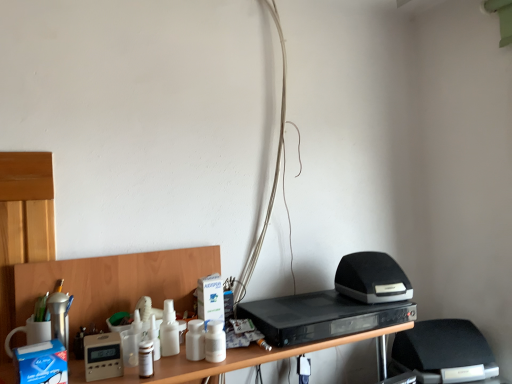
You are a GUI agent. You are given a task and a screenshot of the screen. Output one action in this format:
    pyautogui.click(x=<x>, y=<y>)
    Task: Click on the black matte speaker at right, the first appliance viewed from the top
    The image size is (512, 384).
    Given the screenshot: What is the action you would take?
    pyautogui.click(x=372, y=278)

What do you see at coordinates (372, 278) in the screenshot? The height and width of the screenshot is (384, 512). I see `black matte speaker at right, which appears as the second appliance when viewed from the left` at bounding box center [372, 278].

The height and width of the screenshot is (384, 512). What do you see at coordinates (274, 174) in the screenshot? I see `white matte wires at center` at bounding box center [274, 174].

You are a GUI agent. You are given a task and a screenshot of the screen. Output one action in this format:
    pyautogui.click(x=<x>, y=<y>)
    Task: Click on the black matte speaker at right, which appears as the 1th appliance when viewed from the back
    Image resolution: width=512 pixels, height=384 pixels.
    Given the screenshot: What is the action you would take?
    372,278

Is black matte speaker at right, which is the second appliance from bottom to top, looking in the opposite direction of white matte wires at center?

No, black matte speaker at right, which is the second appliance from bottom to top, is not facing away from white matte wires at center.

From a real-world perspective, relative to white matte wires at center, is black matte speaker at right, the first appliance viewed from the top, vertically above or below?

black matte speaker at right, the first appliance viewed from the top, is below white matte wires at center.

Is black matte speaker at right, which ranks as the 1th appliance in right-to-left order, inside the boundaries of white matte wires at center, or outside?

The correct answer is: outside.

Considering the relative sizes of black matte speaker at right, which appears as the 1th appliance when viewed from the back, and white matte wires at center in the image provided, is black matte speaker at right, which appears as the 1th appliance when viewed from the back, smaller than white matte wires at center?

Yes.

Considering the sizes of objects black matte speaker at right, marked as the second appliance in a front-to-back arrangement, and black fabric computer chair at lower right in the image provided, who is thinner, black matte speaker at right, marked as the second appliance in a front-to-back arrangement, or black fabric computer chair at lower right?

Thinner between the two is black matte speaker at right, marked as the second appliance in a front-to-back arrangement.

Consider the image. Which of these two, black matte speaker at right, which is the second appliance from bottom to top, or black fabric computer chair at lower right, stands shorter?

black matte speaker at right, which is the second appliance from bottom to top.

Is point (382, 286) behind point (417, 357)?

No.

Looking at their sizes, would you say black matte speaker at right, which appears as the second appliance when viewed from the left, is wider or thinner than black plastic dvd player at center?

Clearly, black matte speaker at right, which appears as the second appliance when viewed from the left, has less width compared to black plastic dvd player at center.

Is black matte speaker at right, the first appliance viewed from the top, situated inside black plastic dvd player at center or outside?

black matte speaker at right, the first appliance viewed from the top, is not inside black plastic dvd player at center, it's outside.

Is point (380, 257) closer to viewer compared to point (332, 327)?

No, (380, 257) is further to viewer.

From a real-world perspective, between black matte speaker at right, which is the second appliance from bottom to top, and black plastic dvd player at center, who is vertically higher?

black matte speaker at right, which is the second appliance from bottom to top, from a real-world perspective.

From the image's perspective, between black plastic dvd player at center and white matte wires at center, who is located below?

From the image's view, black plastic dvd player at center is below.

Is white matte wires at center surrounded by black plastic dvd player at center?

Definitely not — white matte wires at center is not inside black plastic dvd player at center.

Considering the positions of objects black plastic dvd player at center and white matte wires at center in the image provided, who is behind, black plastic dvd player at center or white matte wires at center?

white matte wires at center.

Considering the positions of objects black plastic dvd player at center and white matte wires at center in the image provided, who is more to the right, black plastic dvd player at center or white matte wires at center?

Positioned to the right is black plastic dvd player at center.

How many degrees apart are the facing directions of white matte wires at center and black matte speaker at right, marked as the second appliance in a front-to-back arrangement?

The facing directions of white matte wires at center and black matte speaker at right, marked as the second appliance in a front-to-back arrangement, are 2.44 degrees apart.

Considering the positions of point (283, 56) and point (350, 259), is point (283, 56) closer or farther from the camera than point (350, 259)?

Point (283, 56) appears to be farther away from the viewer than point (350, 259).

Would you say white matte wires at center is a long distance from black matte speaker at right, marked as the second appliance in a front-to-back arrangement?

No, white matte wires at center is in close proximity to black matte speaker at right, marked as the second appliance in a front-to-back arrangement.

From the image's perspective, is white matte wires at center below black matte speaker at right, marked as the second appliance in a front-to-back arrangement?

No, from the image's perspective, white matte wires at center is not below black matte speaker at right, marked as the second appliance in a front-to-back arrangement.

Is black fabric computer chair at lower right spatially inside white matte wires at center, or outside of it?

The correct answer is: outside.

Are black fabric computer chair at lower right and white matte wires at center beside each other?

black fabric computer chair at lower right is not next to white matte wires at center, and they're not touching.

From a real-world perspective, who is located higher, black fabric computer chair at lower right or white matte wires at center?

white matte wires at center, from a real-world perspective.

Does point (406, 345) appear closer or farther from the camera than point (262, 229)?

Point (406, 345) is farther from the camera than point (262, 229).

From a real-world perspective, is black plastic dvd player at center below black fabric computer chair at lower right?

No.

Does black plastic dvd player at center turn towards black fabric computer chair at lower right?

No, black plastic dvd player at center is not aimed at black fabric computer chair at lower right.

Would you consider black plastic dvd player at center to be distant from black fabric computer chair at lower right?

Actually, black plastic dvd player at center and black fabric computer chair at lower right are a little close together.

Considering the sizes of objects black plastic dvd player at center and black fabric computer chair at lower right in the image provided, who is wider, black plastic dvd player at center or black fabric computer chair at lower right?

black fabric computer chair at lower right.

At what (x,y) coordinates should I click in order to perform the action: click on appliance located on the right of white matte wires at center. Please return your answer as a coordinate pair (x, y). This screenshot has width=512, height=384. Looking at the image, I should click on (372, 278).

From a real-world perspective, count 2nd appliances upward from the black fabric computer chair at lower right and point to it. Please provide its 2D coordinates.

[(372, 278)]

Which object lies nearer to the anchor point beige plastic thermostat at lower left, the 2th appliance positioned from the back, black plastic dvd player at center or black matte speaker at right, which is the second appliance from bottom to top?

The object closer to beige plastic thermostat at lower left, the 2th appliance positioned from the back, is black plastic dvd player at center.

From the image, which object appears to be nearer to beige plastic thermostat at lower left, which appears as the 2th appliance when viewed from the right, black fabric computer chair at lower right or black plastic dvd player at center?

black plastic dvd player at center is positioned closer to the anchor beige plastic thermostat at lower left, which appears as the 2th appliance when viewed from the right.

Based on their spatial positions, is black matte speaker at right, which is the second appliance from bottom to top, or white matte wires at center further from beige plastic thermostat at lower left, which appears as the 2th appliance when viewed from the right?

black matte speaker at right, which is the second appliance from bottom to top, is positioned further to the anchor beige plastic thermostat at lower left, which appears as the 2th appliance when viewed from the right.

Estimate the real-world distances between objects in this image. Which object is further from black plastic dvd player at center, beige plastic thermostat at lower left, which appears as the 2th appliance when viewed from the right, or white matte wires at center?

Based on the image, beige plastic thermostat at lower left, which appears as the 2th appliance when viewed from the right, appears to be further to black plastic dvd player at center.

From the image, which object appears to be farther from white matte wires at center, black fabric computer chair at lower right or black plastic dvd player at center?

black fabric computer chair at lower right lies further to white matte wires at center than the other object.

From the image, which object appears to be farther from black plastic dvd player at center, black matte speaker at right, which ranks as the 1th appliance in right-to-left order, or white matte wires at center?

white matte wires at center.

Based on their spatial positions, is black fabric computer chair at lower right or white matte wires at center closer to beige plastic thermostat at lower left, the 1th appliance from the left?

white matte wires at center.

Looking at the image, which one is located further to black matte speaker at right, marked as the second appliance in a front-to-back arrangement, black fabric computer chair at lower right or beige plastic thermostat at lower left, which appears as the 2th appliance when viewed from the right?

Among the two, beige plastic thermostat at lower left, which appears as the 2th appliance when viewed from the right, is located further to black matte speaker at right, marked as the second appliance in a front-to-back arrangement.

Locate an element on the screen. This screenshot has width=512, height=384. wire situated between beige plastic thermostat at lower left, acting as the first appliance starting from the bottom, and black fabric computer chair at lower right from left to right is located at coordinates (274, 174).

The image size is (512, 384). I want to click on home appliance between white matte wires at center and black fabric computer chair at lower right from top to bottom, so click(320, 317).

Where is `home appliance between beige plastic thermostat at lower left, which appears as the 2th appliance when viewed from the right, and black fabric computer chair at lower right`? This screenshot has height=384, width=512. home appliance between beige plastic thermostat at lower left, which appears as the 2th appliance when viewed from the right, and black fabric computer chair at lower right is located at coordinates (320, 317).

In order to click on appliance between black plastic dvd player at center and black fabric computer chair at lower right from left to right in this screenshot , I will do `click(372, 278)`.